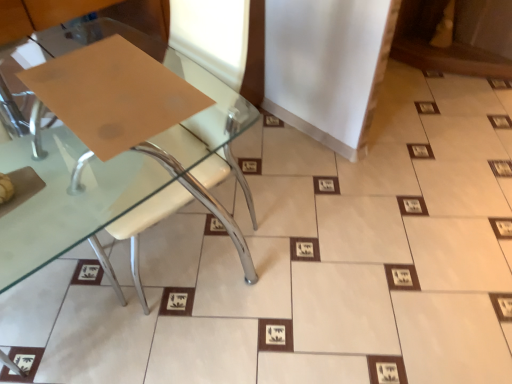
Question: From a real-world perspective, is matte brown paper at upper left physically below matte brown paper at lower left?

Choices:
 (A) no
 (B) yes

Answer: (A)

Question: Is matte brown paper at upper left beside matte brown paper at lower left?

Choices:
 (A) no
 (B) yes

Answer: (A)

Question: From the image's perspective, is matte brown paper at upper left below matte brown paper at lower left?

Choices:
 (A) no
 (B) yes

Answer: (A)

Question: Does matte brown paper at upper left lie behind matte brown paper at lower left?

Choices:
 (A) yes
 (B) no

Answer: (A)

Question: From a real-world perspective, is matte brown paper at upper left on top of matte brown paper at lower left?

Choices:
 (A) yes
 (B) no

Answer: (A)

Question: Does matte brown paper at upper left appear on the left side of matte brown paper at lower left?

Choices:
 (A) yes
 (B) no

Answer: (A)

Question: Is matte brown paper at lower left facing towards matte brown paper at upper left?

Choices:
 (A) no
 (B) yes

Answer: (B)

Question: Is matte brown paper at lower left bigger than matte brown paper at upper left?

Choices:
 (A) yes
 (B) no

Answer: (A)

Question: From a real-world perspective, is matte brown paper at lower left positioned over matte brown paper at upper left based on gravity?

Choices:
 (A) no
 (B) yes

Answer: (A)

Question: From a real-world perspective, is matte brown paper at lower left physically below matte brown paper at upper left?

Choices:
 (A) yes
 (B) no

Answer: (A)

Question: Considering the relative sizes of matte brown paper at lower left and matte brown paper at upper left in the image provided, is matte brown paper at lower left wider than matte brown paper at upper left?

Choices:
 (A) no
 (B) yes

Answer: (B)

Question: Does matte brown paper at lower left appear on the left side of matte brown paper at upper left?

Choices:
 (A) no
 (B) yes

Answer: (A)

Question: Looking at their shapes, would you say matte brown paper at lower left is wider or thinner than matte brown paper at upper left?

Choices:
 (A) wide
 (B) thin

Answer: (A)